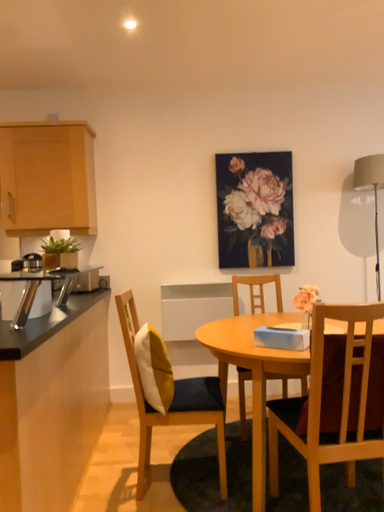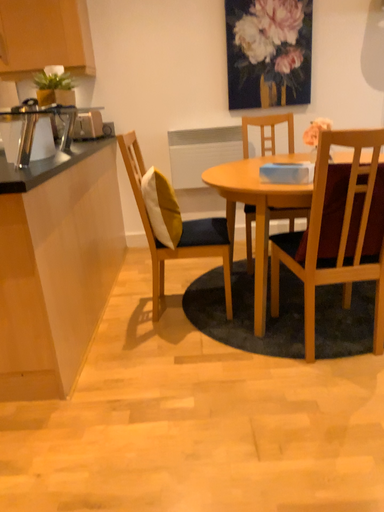
Question: Which way did the camera rotate in the video?

Choices:
 (A) rotated downward
 (B) rotated upward

Answer: (A)